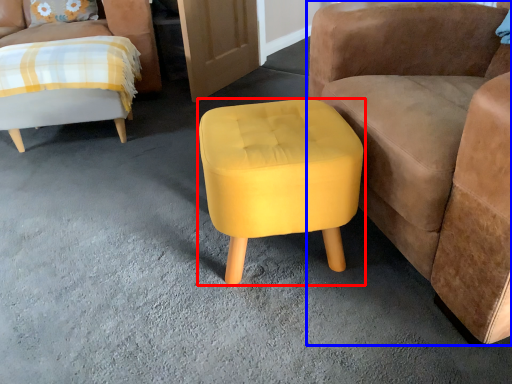
Question: Which point is further to the camera, stool (highlighted by a red box) or chair (highlighted by a blue box)?

Choices:
 (A) stool
 (B) chair

Answer: (A)